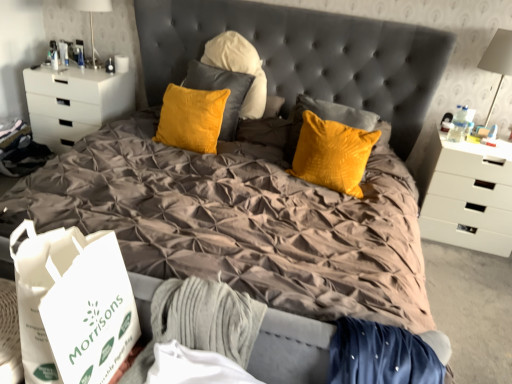
Question: Considering the relative sizes of white matte chest of drawers at left, placed as the 2th chest of drawers when sorted from right to left, and white glossy table lamp at upper left, which appears as the 2th table lamp when viewed from the right, in the image provided, is white matte chest of drawers at left, placed as the 2th chest of drawers when sorted from right to left, bigger than white glossy table lamp at upper left, which appears as the 2th table lamp when viewed from the right,?

Choices:
 (A) yes
 (B) no

Answer: (A)

Question: Considering the relative sizes of white matte chest of drawers at left, placed as the 2th chest of drawers when sorted from right to left, and white glossy table lamp at upper left, arranged as the first table lamp when viewed from the left, in the image provided, is white matte chest of drawers at left, placed as the 2th chest of drawers when sorted from right to left, taller than white glossy table lamp at upper left, arranged as the first table lamp when viewed from the left,?

Choices:
 (A) yes
 (B) no

Answer: (A)

Question: Considering the relative positions of white matte chest of drawers at left, positioned as the first chest of drawers in left-to-right order, and white glossy table lamp at upper left, the 2th table lamp viewed from the front, in the image provided, is white matte chest of drawers at left, positioned as the first chest of drawers in left-to-right order, to the left of white glossy table lamp at upper left, the 2th table lamp viewed from the front, from the viewer's perspective?

Choices:
 (A) yes
 (B) no

Answer: (A)

Question: From a real-world perspective, does white matte chest of drawers at left, positioned as the first chest of drawers in left-to-right order, sit lower than white glossy table lamp at upper left, the 2th table lamp viewed from the front?

Choices:
 (A) no
 (B) yes

Answer: (B)

Question: Can you confirm if white matte chest of drawers at left, placed as the 2th chest of drawers when sorted from right to left, is positioned to the right of white glossy table lamp at upper left, which is the 2th table lamp from bottom to top?

Choices:
 (A) no
 (B) yes

Answer: (A)

Question: From a real-world perspective, is white matte chest of drawers at right, the first chest of drawers viewed from the right, positioned above or below white glossy table lamp at upper left, which is the 2th table lamp from bottom to top?

Choices:
 (A) below
 (B) above

Answer: (A)

Question: Does point (501, 178) appear closer or farther from the camera than point (79, 1)?

Choices:
 (A) closer
 (B) farther

Answer: (A)

Question: In the image, is white matte chest of drawers at right, the first chest of drawers viewed from the right, positioned in front of or behind white glossy table lamp at upper left, which appears as the 2th table lamp when viewed from the right?

Choices:
 (A) front
 (B) behind

Answer: (A)

Question: Based on their positions, is white matte chest of drawers at right, the first chest of drawers viewed from the right, located to the left or right of white glossy table lamp at upper left, the 2th table lamp viewed from the front?

Choices:
 (A) left
 (B) right

Answer: (B)

Question: Considering the relative positions of white matte chest of drawers at right, the first chest of drawers viewed from the right, and white paper bag at lower left in the image provided, is white matte chest of drawers at right, the first chest of drawers viewed from the right, to the left or to the right of white paper bag at lower left?

Choices:
 (A) right
 (B) left

Answer: (A)

Question: Is white matte chest of drawers at right, the 2th chest of drawers when ordered from left to right, taller or shorter than white paper bag at lower left?

Choices:
 (A) short
 (B) tall

Answer: (B)

Question: Would you say white matte chest of drawers at right, the 2th chest of drawers when ordered from left to right, is inside or outside white paper bag at lower left?

Choices:
 (A) outside
 (B) inside

Answer: (A)

Question: Considering the positions of point (478, 177) and point (20, 228), is point (478, 177) closer or farther from the camera than point (20, 228)?

Choices:
 (A) closer
 (B) farther

Answer: (B)

Question: Would you say white matte chest of drawers at left, positioned as the first chest of drawers in left-to-right order, is to the left or to the right of white glossy table lamp at upper left, arranged as the first table lamp when viewed from the left, in the picture?

Choices:
 (A) left
 (B) right

Answer: (A)

Question: From a real-world perspective, is white matte chest of drawers at left, positioned as the first chest of drawers in left-to-right order, physically located above or below white glossy table lamp at upper left, the first table lamp from the back?

Choices:
 (A) above
 (B) below

Answer: (B)